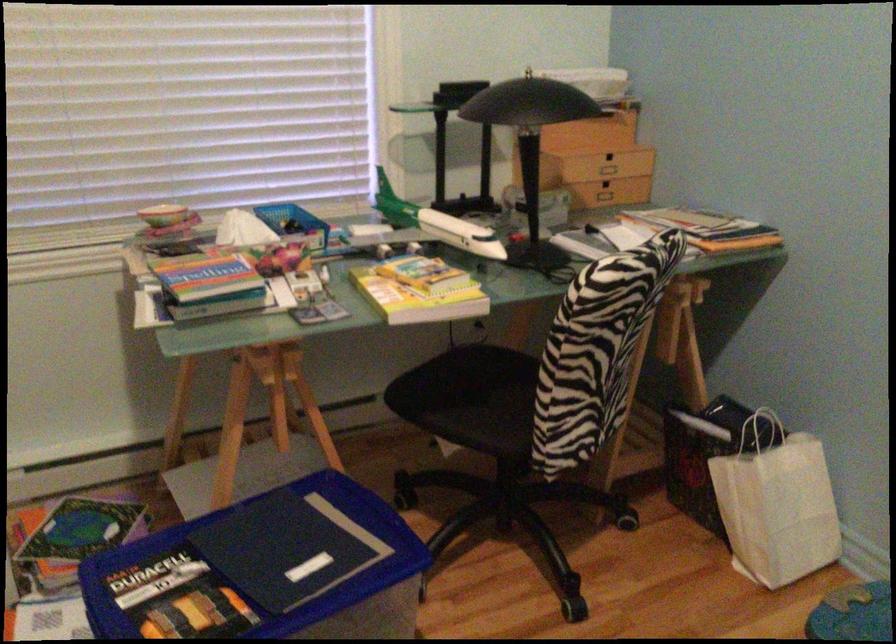
Where would you lift the blue bin lid? Please return your answer as a coordinate pair (x, y).

(316, 551)